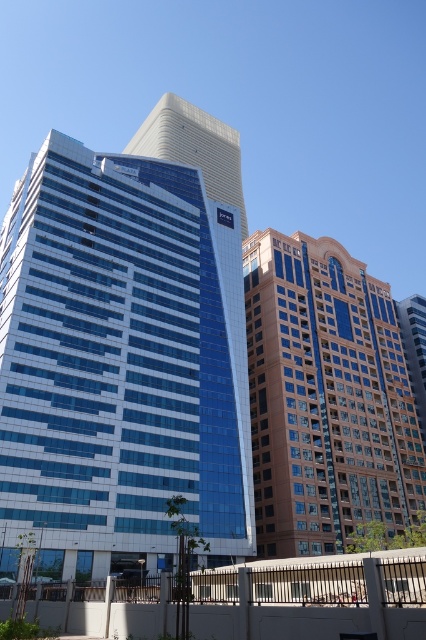
Question: Based on their relative distances, which object is nearer to the brown brick building at center?

Choices:
 (A) white glass skyscraper at center
 (B) blue glass building at center

Answer: (B)

Question: Does brown brick building at center have a lesser width compared to white glass skyscraper at center?

Choices:
 (A) yes
 (B) no

Answer: (A)

Question: Where is blue glass building at center located in relation to brown brick building at center in the image?

Choices:
 (A) right
 (B) left

Answer: (B)

Question: Can you confirm if blue glass building at center is thinner than white glass skyscraper at center?

Choices:
 (A) yes
 (B) no

Answer: (A)

Question: Which of the following is the closest to the observer?

Choices:
 (A) click(x=242, y=234)
 (B) click(x=22, y=323)
 (C) click(x=334, y=468)

Answer: (B)

Question: Which of the following is the farthest from the observer?

Choices:
 (A) (129, 504)
 (B) (282, 547)

Answer: (B)